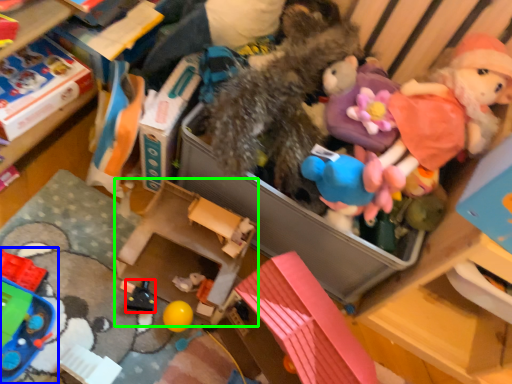
Question: Which is farther away from toy (highlighted by a red box)? toy (highlighted by a blue box) or storage box (highlighted by a green box)?

Choices:
 (A) toy
 (B) storage box

Answer: (A)